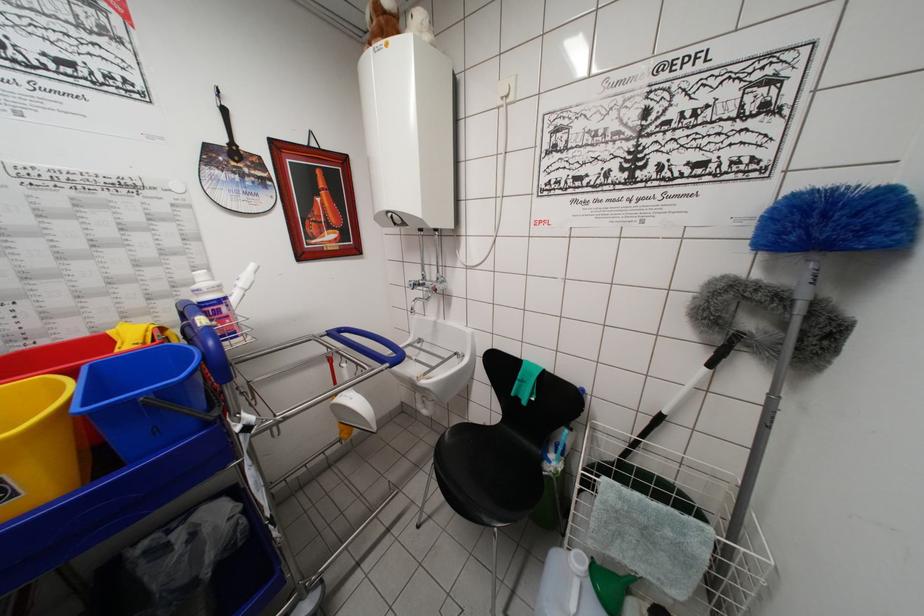
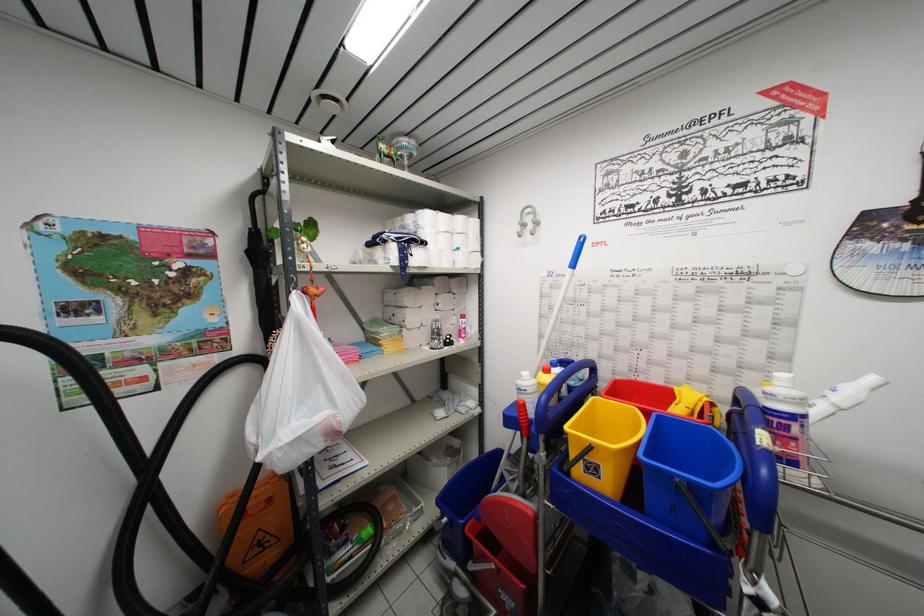
In the second image, find the point that corresponds to point (250, 294) in the first image.

(845, 415)